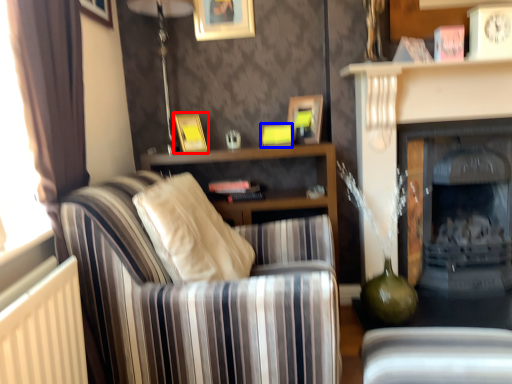
Question: Which object is further to the camera taking this photo, picture frame (highlighted by a red box) or picture frame (highlighted by a blue box)?

Choices:
 (A) picture frame
 (B) picture frame

Answer: (B)